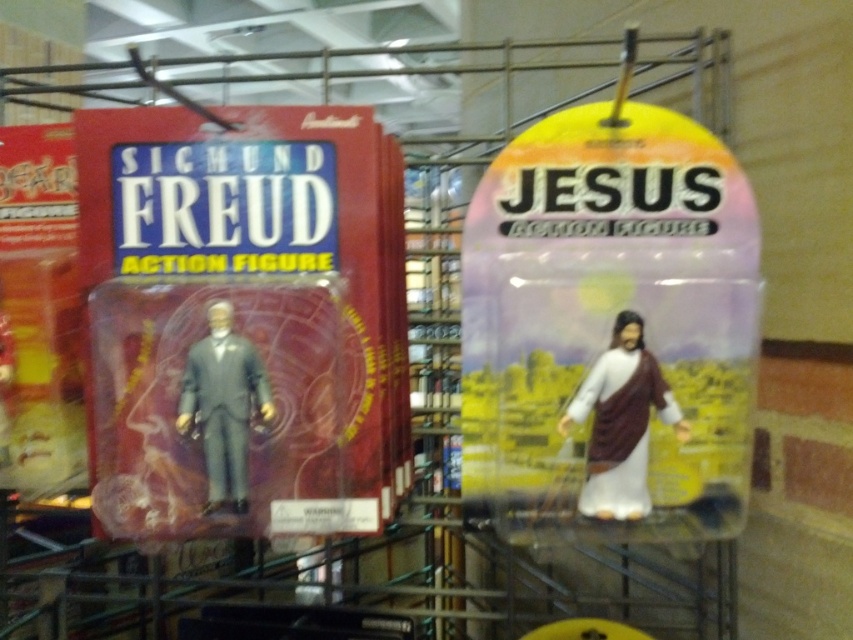
Question: Is white matte jesus action figure at right behind matte gray suit at left?

Choices:
 (A) yes
 (B) no

Answer: (B)

Question: Which point is farther from the camera taking this photo?

Choices:
 (A) (241, 381)
 (B) (611, 372)

Answer: (A)

Question: Among these points, which one is farthest from the camera?

Choices:
 (A) [186, 372]
 (B) [610, 408]

Answer: (A)

Question: Can you confirm if white matte jesus action figure at right is positioned below matte gray suit at left?

Choices:
 (A) yes
 (B) no

Answer: (A)

Question: From the image, what is the correct spatial relationship of white matte jesus action figure at right in relation to matte gray suit at left?

Choices:
 (A) right
 (B) left

Answer: (A)

Question: Which point is closer to the camera?

Choices:
 (A) white matte jesus action figure at right
 (B) matte gray suit at left

Answer: (A)